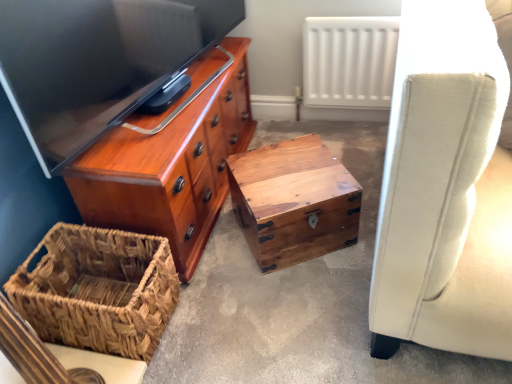
Identify the location of free location in front of natural wood trunk at center. (293, 295).